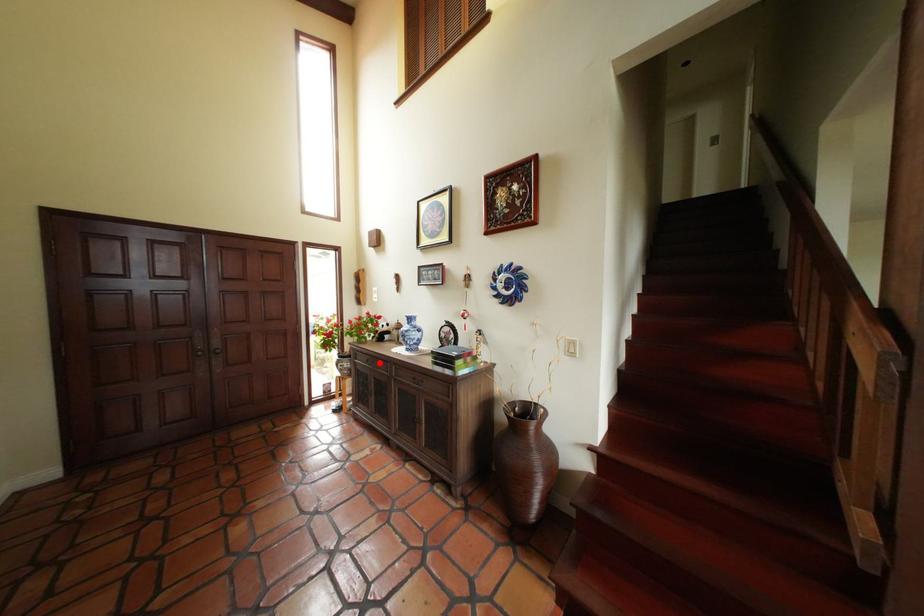
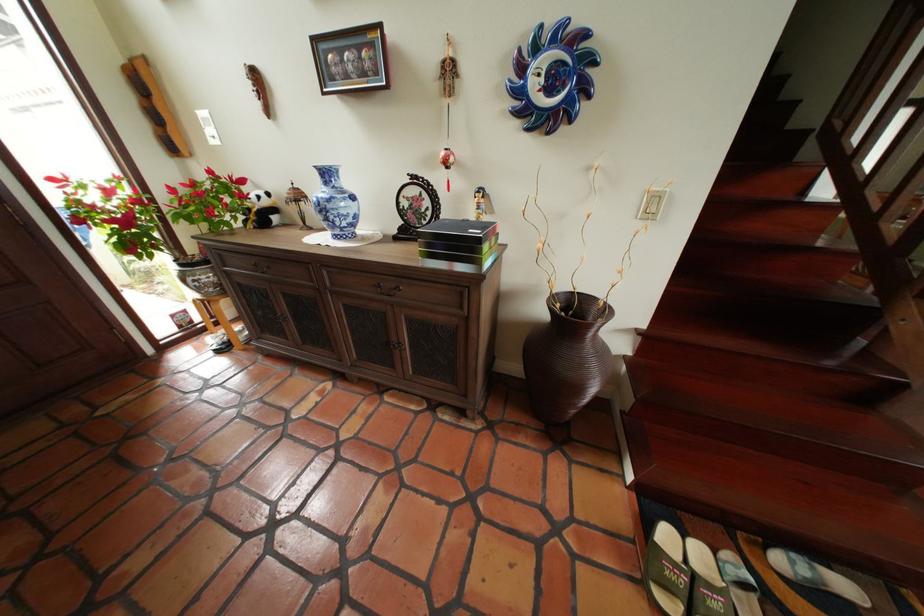
Question: I am providing you with two images of the same scene from different viewpoints. Image1 has a red point marked. In image2, the corresponding 3D location appears at what relative position? Reply with the corresponding letter.

Choices:
 (A) Closer
 (B) Farther

Answer: (A)